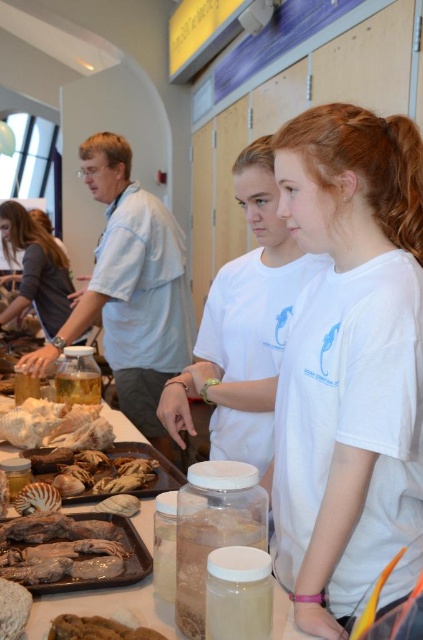
Question: Where is brown matte duck at lower left located in relation to brown crumbly bread at lower left in the image?

Choices:
 (A) above
 (B) below

Answer: (A)

Question: Which point appears closest to the camera in this image?

Choices:
 (A) (90, 630)
 (B) (21, 588)
 (C) (143, 529)
 (D) (0, 224)

Answer: (A)

Question: Which object is farther from the camera taking this photo?

Choices:
 (A) brown crumbly bread at lower left
 (B) fuzzy brown bread at lower left
 (C) translucent plastic tray at center

Answer: (C)

Question: Can you confirm if white cotton t-shirt at center is positioned above translucent plastic tray at center?

Choices:
 (A) yes
 (B) no

Answer: (A)

Question: Is translucent plastic tray at center positioned before brown crumbly bread at lower left?

Choices:
 (A) no
 (B) yes

Answer: (A)

Question: Which point is closer to the camera?

Choices:
 (A) matte gray shirt at center
 (B) fuzzy brown bread at lower left
 (C) brown matte duck at lower left
 (D) translucent plastic tray at center

Answer: (B)